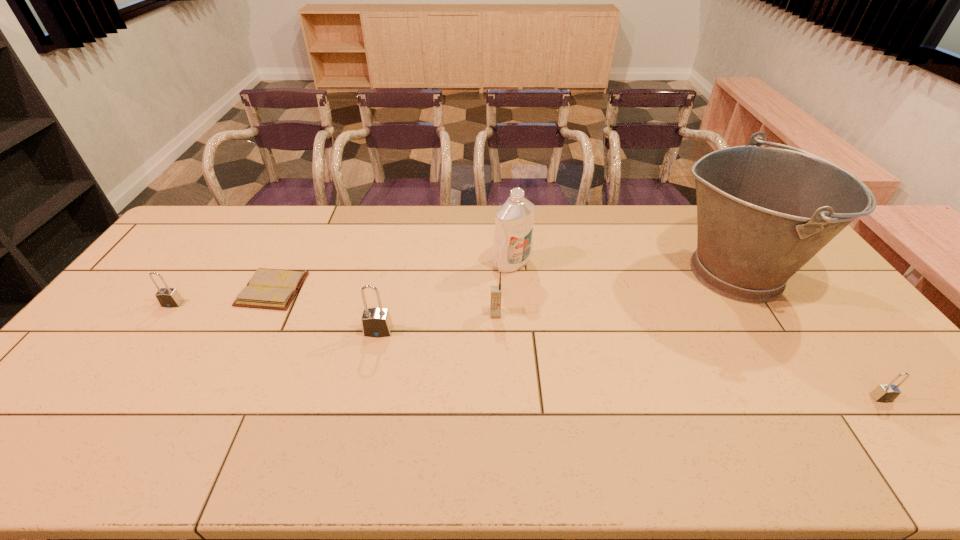
Locate an element on the screen. The width and height of the screenshot is (960, 540). the third shortest object is located at coordinates (167, 297).

This screenshot has width=960, height=540. In order to click on the second shortest padlock in this screenshot , I will do `click(167, 297)`.

Find the location of a particular element. the tallest padlock is located at coordinates (376, 322).

Identify the location of the second padlock from left to right. This screenshot has height=540, width=960. (376, 322).

Where is `the shortest padlock`? the shortest padlock is located at coordinates (884, 393).

Where is `the rightmost padlock`? The width and height of the screenshot is (960, 540). the rightmost padlock is located at coordinates (884, 393).

Find the location of `the tallest object`. the tallest object is located at coordinates 763,212.

Find the location of a particular element. Image resolution: width=960 pixels, height=540 pixels. the second object from left to right is located at coordinates (275, 289).

Find the location of a particular element. The width and height of the screenshot is (960, 540). the shortest object is located at coordinates (275, 289).

Where is `the sixth shortest object`? The image size is (960, 540). the sixth shortest object is located at coordinates (513, 241).